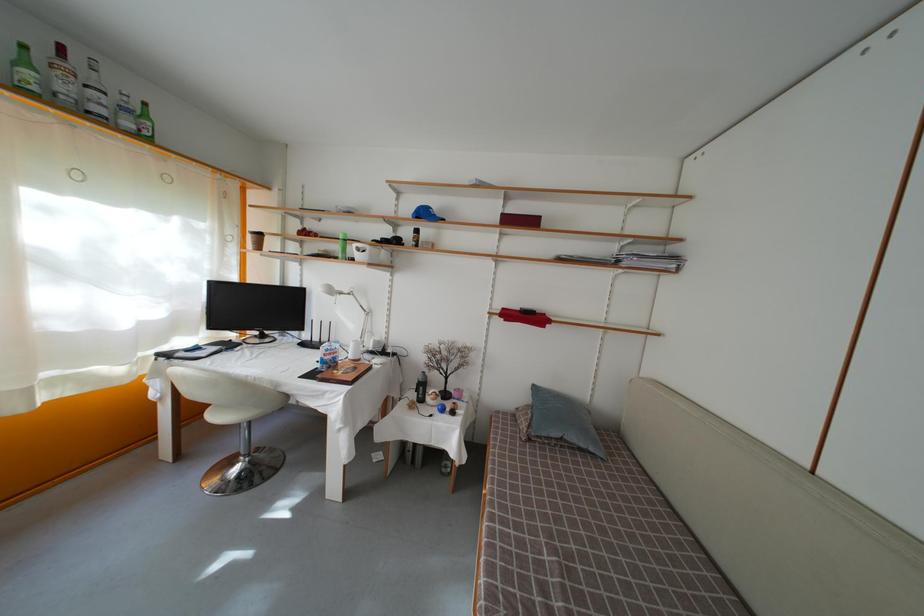
This screenshot has width=924, height=616. Identify the location of chair sitting surface. (228, 415).